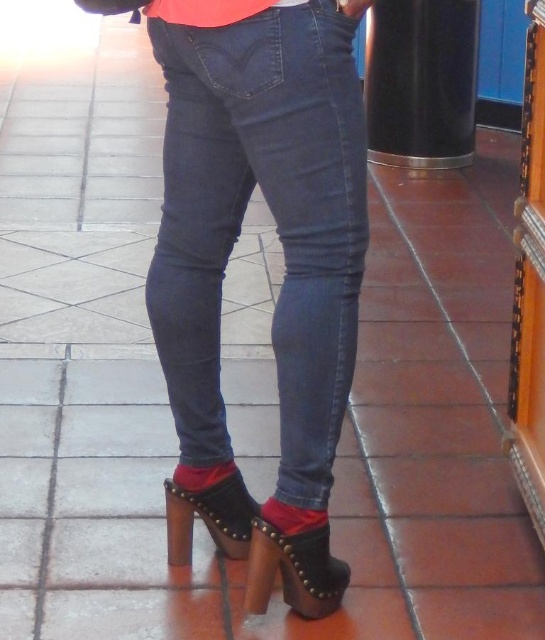
Based on the photo, you are standing in front of a person wearing dark blue jeans and black high heels. There is a specific point at coordinates point (383, 141). If you want to touch that point with a stick that is 4 meters long, will you be able to reach it?

The point (383, 141) is 4.56 meters away from the viewer. Since the stick is only 4 meters long, you cannot reach the point with the stick.

You are an interior designer planning to place a 1.5 meter wide sofa in the living room. The sofa must be placed between the black glossy pillar at upper right and the nearest wall. The distance between the pillar and the wall is 4.18 meters. Will the sofa fit comfortably with at least 0.5 meters of space on both ends?

The distance between the black glossy pillar at upper right and the nearest wall is 4.18 meters. The sofa is 1.5 meters wide, so subtracting the required 0.5 meters of space on both ends leaves 4.18m minus 1.5m minus 1m equals 1.68 meters remaining. This means there is more than enough space for the sofa with comfortable spacing.

You are an interior designer planning to place a 20 cm wide decorative item on the surface next to the denim jeans at center and the black glossy pillar at upper right. Which object should you place it next to if you want to ensure there is enough space?

The denim jeans at center has a lesser width compared to the black glossy pillar at upper right, so placing the 20 cm wide decorative item next to the black glossy pillar at upper right would provide more space due to its greater width.